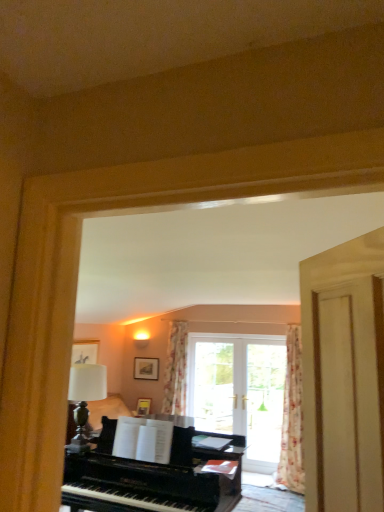
Question: In terms of width, does floral fabric curtain at center, marked as the 2th curtain in a right-to-left arrangement, look wider or thinner when compared to floral fabric curtain at right, which ranks as the second curtain in back-to-front order?

Choices:
 (A) wide
 (B) thin

Answer: (B)

Question: From their relative heights in the image, would you say floral fabric curtain at center, the 1th curtain when ordered from back to front, is taller or shorter than floral fabric curtain at right, which is the second curtain from left to right?

Choices:
 (A) short
 (B) tall

Answer: (A)

Question: Which object is the farthest from the black polished piano at center?

Choices:
 (A) floral fabric curtain at right, which is the second curtain from left to right
 (B) matte black picture frame at center, acting as the second picture frame starting from the bottom
 (C) transparent glass door at center
 (D) floral fabric curtain at center, which appears as the first curtain when viewed from the left
 (E) wooden picture frame at center, which appears as the 2th picture frame when viewed from the top

Answer: (E)

Question: Which object is the farthest from the matte black picture frame at center, acting as the second picture frame starting from the bottom?

Choices:
 (A) wooden picture frame at center, positioned as the first picture frame in bottom-to-top order
 (B) floral fabric curtain at center, which appears as the first curtain when viewed from the left
 (C) floral fabric curtain at right, the 1th curtain viewed from the right
 (D) black polished piano at center
 (E) transparent glass door at center

Answer: (D)